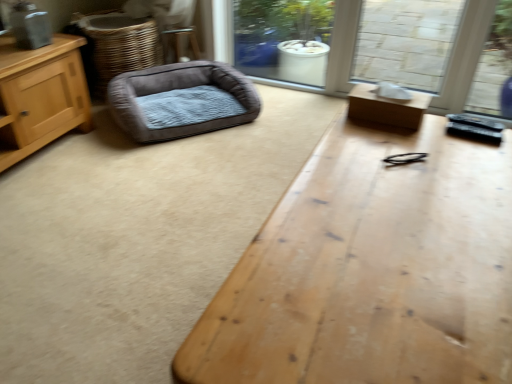
Question: Considering the relative positions of brown woven basket at left and wooden table at center, the 1th table when ordered from bottom to top, in the image provided, is brown woven basket at left in front of wooden table at center, the 1th table when ordered from bottom to top,?

Choices:
 (A) no
 (B) yes

Answer: (A)

Question: Can you confirm if brown woven basket at left is bigger than wooden table at center, the 1th table when ordered from bottom to top?

Choices:
 (A) yes
 (B) no

Answer: (B)

Question: Is brown woven basket at left behind wooden table at center, which is the 2th table in top-to-bottom order?

Choices:
 (A) no
 (B) yes

Answer: (B)

Question: Is brown woven basket at left positioned far away from wooden table at center, the 1th table when ordered from bottom to top?

Choices:
 (A) no
 (B) yes

Answer: (B)

Question: Can you confirm if brown woven basket at left is shorter than wooden table at center, which is the 2th table in top-to-bottom order?

Choices:
 (A) yes
 (B) no

Answer: (B)

Question: Does brown woven basket at left have a lesser width compared to wooden table at center, the 1th table when ordered from bottom to top?

Choices:
 (A) yes
 (B) no

Answer: (A)

Question: From the image's perspective, is wooden table at center, which is the 2th table in top-to-bottom order, under velvet-like brown dog bed at left?

Choices:
 (A) no
 (B) yes

Answer: (B)

Question: Is wooden table at center, the 1th table when ordered from bottom to top, shorter than velvet-like brown dog bed at left?

Choices:
 (A) yes
 (B) no

Answer: (B)

Question: Does wooden table at center, the 1th table when ordered from bottom to top, have a lesser width compared to velvet-like brown dog bed at left?

Choices:
 (A) yes
 (B) no

Answer: (B)

Question: Does wooden table at center, which is the 2th table in top-to-bottom order, have a greater height compared to velvet-like brown dog bed at left?

Choices:
 (A) yes
 (B) no

Answer: (A)

Question: From the image's perspective, would you say wooden table at center, which is the 2th table in top-to-bottom order, is positioned over velvet-like brown dog bed at left?

Choices:
 (A) no
 (B) yes

Answer: (A)

Question: Is velvet-like brown dog bed at left inside wooden table at center, which is the 2th table in top-to-bottom order?

Choices:
 (A) no
 (B) yes

Answer: (A)

Question: Can you confirm if wooden table at center, the 1th table when ordered from bottom to top, is smaller than brown cardboard box at right, marked as the 1th table in a top-to-bottom arrangement?

Choices:
 (A) yes
 (B) no

Answer: (B)